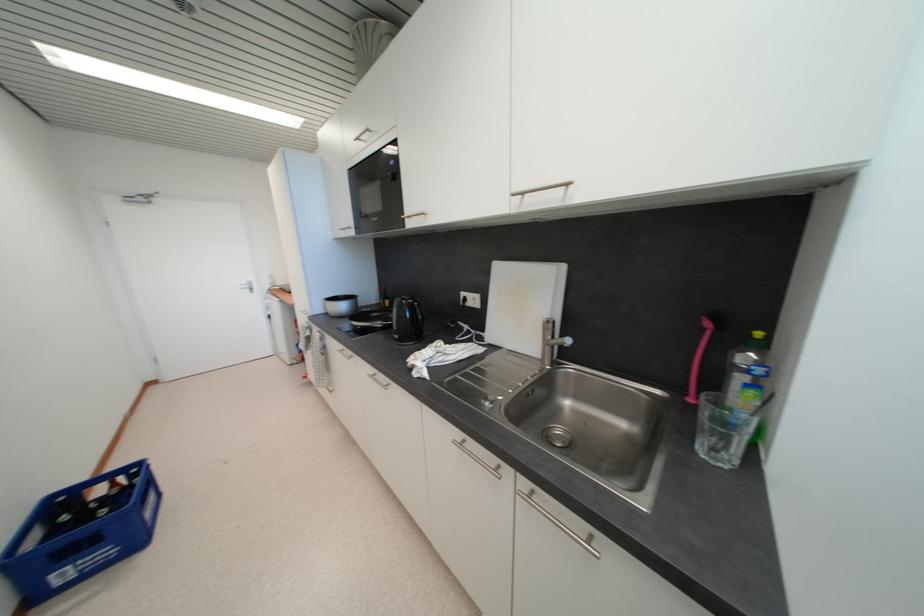
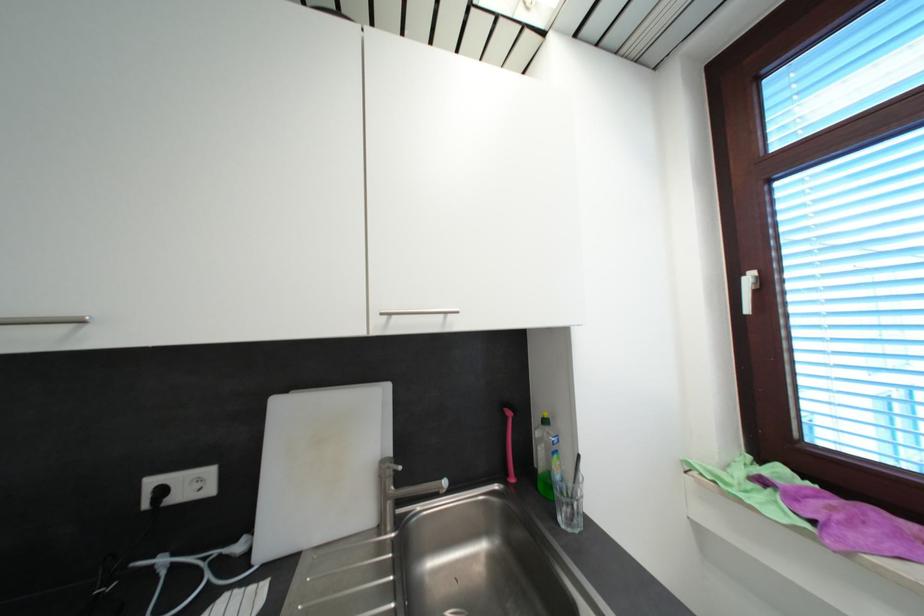
Locate, in the second image, the point that corresponds to (710,331) in the first image.

(512, 419)